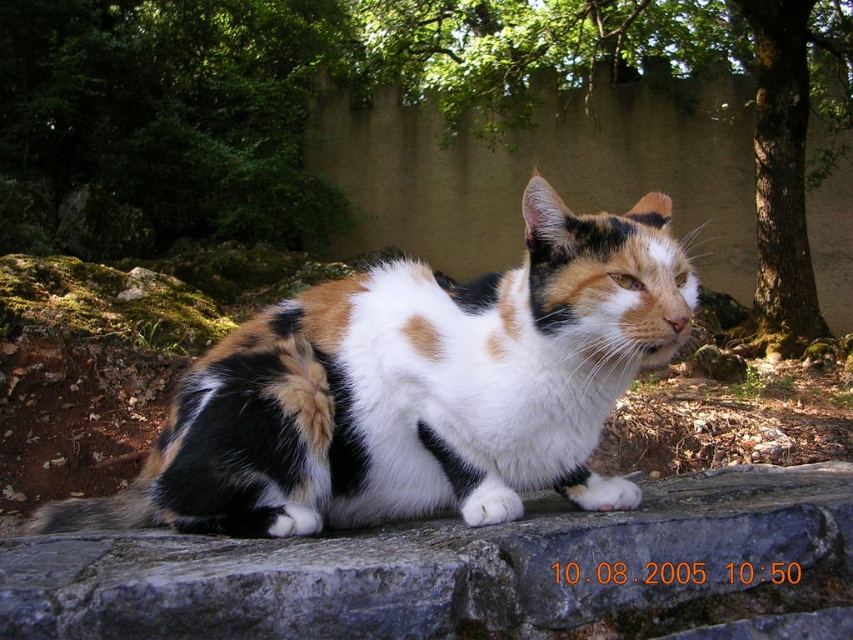
Question: Does gray stone at center appear on the left side of green leafy tree at upper left?

Choices:
 (A) yes
 (B) no

Answer: (B)

Question: From the image, what is the correct spatial relationship of gray stone at center in relation to green leafy tree at upper left?

Choices:
 (A) above
 (B) below

Answer: (B)

Question: Which of the following is the closest to the observer?

Choices:
 (A) gray stone at center
 (B) green leafy tree at upper center

Answer: (A)

Question: Does calico fur cat at center appear under gray stone at center?

Choices:
 (A) no
 (B) yes

Answer: (A)

Question: Which object is the closest to the green leafy tree at upper center?

Choices:
 (A) calico fur cat at center
 (B) gray stone at center

Answer: (B)

Question: Estimate the real-world distances between objects in this image. Which object is closer to the gray stone at center?

Choices:
 (A) green leafy tree at upper center
 (B) calico fur cat at center
 (C) green leafy tree at upper left

Answer: (B)